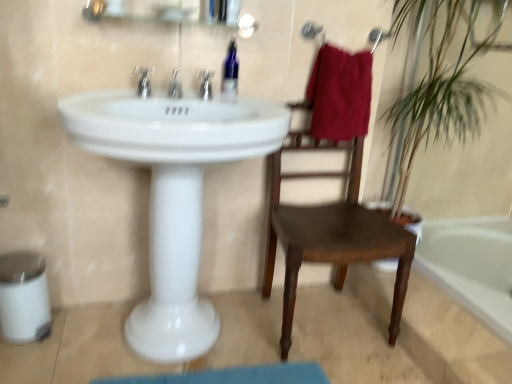
Question: From a real-world perspective, is green leafy plant at right above or below matte silver faucet at center, which is the 1th tap in right-to-left order?

Choices:
 (A) below
 (B) above

Answer: (A)

Question: Based on their positions, is green leafy plant at right located to the left or right of matte silver faucet at center, which is the 3th tap from left to right?

Choices:
 (A) left
 (B) right

Answer: (B)

Question: Which is farther from the metallic glass medicine cabinet at upper center?

Choices:
 (A) silver metallic faucet at upper center, acting as the 3th tap starting from the right
 (B) burgundy cotton towel at upper right
 (C) matte silver faucet at center, which is the 3th tap from left to right
 (D) silver metallic tap at center, the 2th tap positioned from the left
 (E) white glossy bathtub at lower right

Answer: (E)

Question: Estimate the real-world distances between objects in this image. Which object is farther from the green leafy plant at right?

Choices:
 (A) blue glossy bottle at upper center
 (B) silver metallic tap at center, the 2th tap positioned from the left
 (C) silver metallic faucet at upper center, positioned as the first tap in left-to-right order
 (D) burgundy cotton towel at upper right
 (E) white glossy bathtub at lower right

Answer: (C)